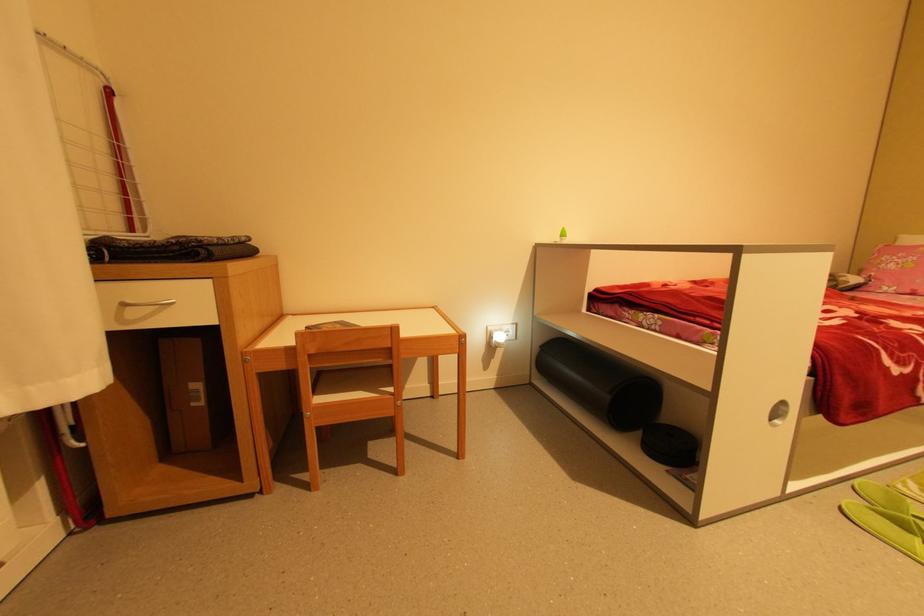
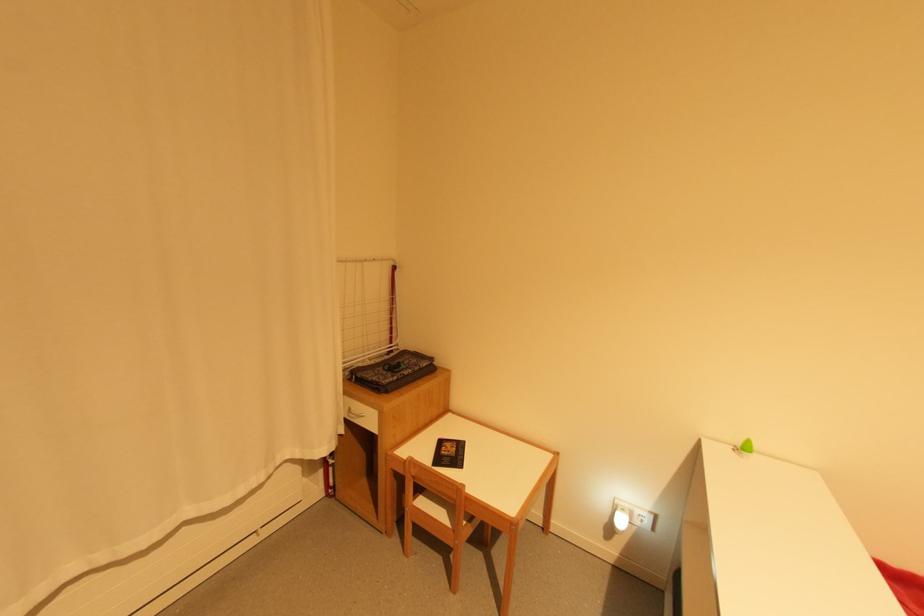
The point at (501, 331) is marked in the first image. Where is the corresponding point in the second image?

(627, 511)